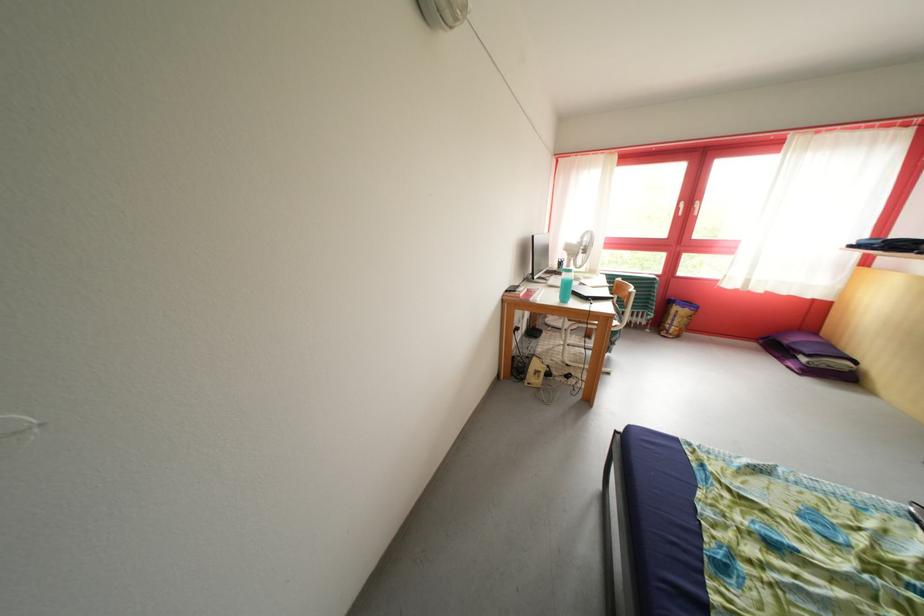
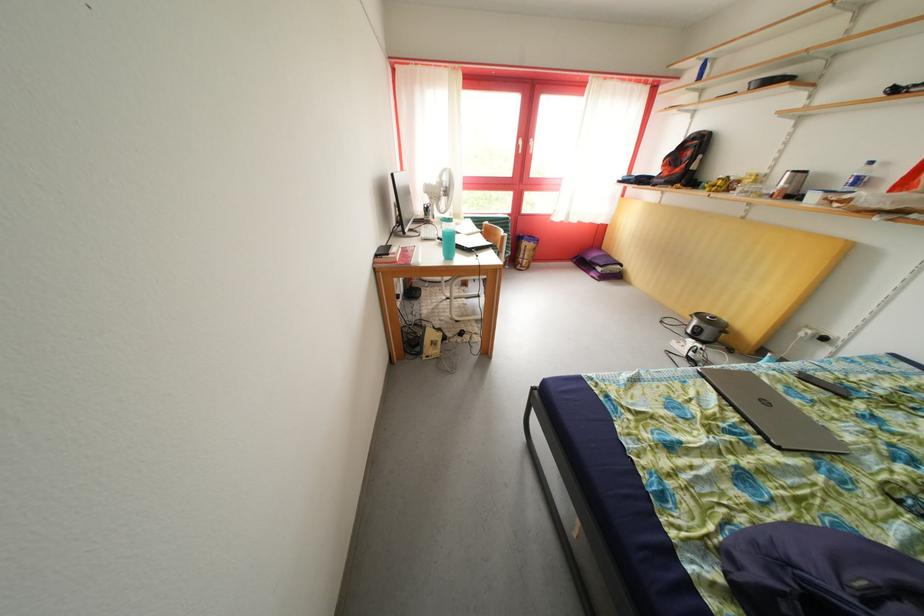
Locate, in the second image, the point that corresponds to pixel 688 211 in the first image.

(528, 148)